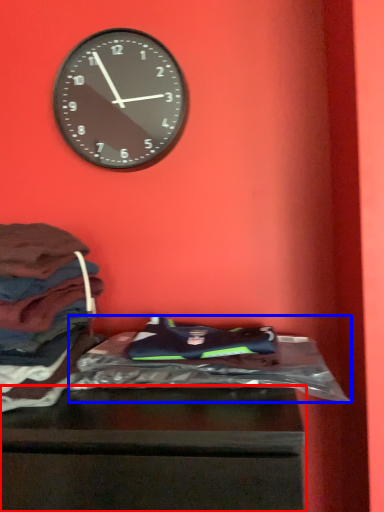
Question: Which point is further to the camera, furniture (highlighted by a red box) or material (highlighted by a blue box)?

Choices:
 (A) furniture
 (B) material

Answer: (B)